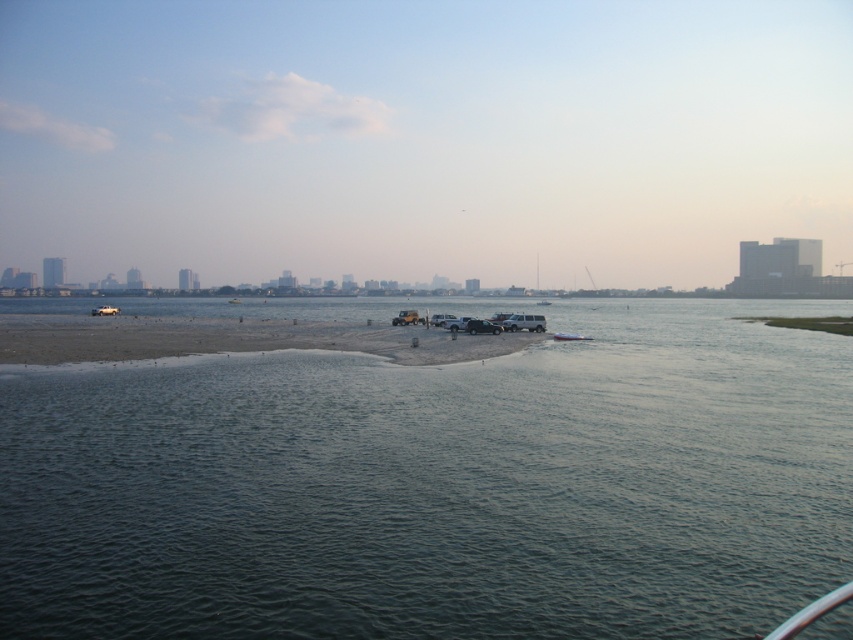
Question: Which point appears closest to the camera in this image?

Choices:
 (A) (91, 340)
 (B) (585, 336)

Answer: (A)

Question: Where is greenish-blue water at center located in relation to brown sandy beach at center in the image?

Choices:
 (A) left
 (B) right

Answer: (B)

Question: Which object is positioned closest to the greenish-blue water at center?

Choices:
 (A) brown sandy beach at center
 (B) metallic silver boat at center

Answer: (A)

Question: Does greenish-blue water at center have a smaller size compared to brown sandy beach at center?

Choices:
 (A) no
 (B) yes

Answer: (A)

Question: Is greenish-blue water at center below metallic silver boat at center?

Choices:
 (A) yes
 (B) no

Answer: (B)

Question: Which of the following is the closest to the observer?

Choices:
 (A) (677, 332)
 (B) (579, 336)

Answer: (B)